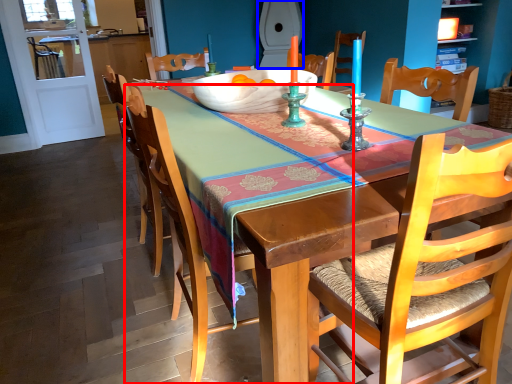
Question: Which point is further to the camera, chair (highlighted by a red box) or toilet (highlighted by a blue box)?

Choices:
 (A) chair
 (B) toilet

Answer: (B)